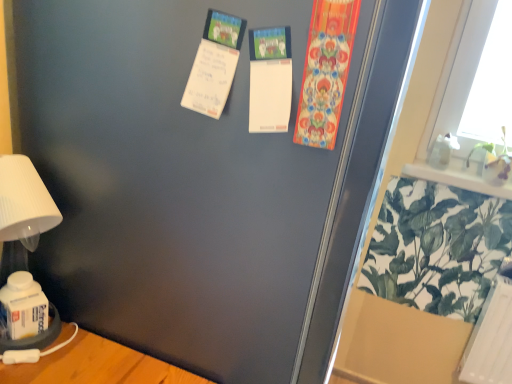
Question: Looking at the image, does green leafy plant at lower right, the first plant when ordered from bottom to top, seem bigger or smaller compared to white matte table lamp at lower left?

Choices:
 (A) small
 (B) big

Answer: (A)

Question: From the image's perspective, is green leafy plant at lower right, the second plant when ordered from top to bottom, positioned above or below white matte table lamp at lower left?

Choices:
 (A) below
 (B) above

Answer: (A)

Question: Based on their relative distances, which object is farther from the transparent plastic screen door at upper right?

Choices:
 (A) white paper postcard at upper center, which is the first postcard from left to right
 (B) green leafy plant at upper right, which appears as the 2th plant when ordered from the bottom
 (C) colorful fabric banner at upper right, which is counted as the second postcard, starting from the left
 (D) green leafy plant at lower right, the second plant when ordered from top to bottom
 (E) white matte table lamp at lower left

Answer: (B)

Question: Which object is positioned farthest from the green leafy plant at lower right, the second plant when ordered from top to bottom?

Choices:
 (A) colorful fabric banner at upper right, which is counted as the second postcard, starting from the left
 (B) green leafy plant at upper right, which appears as the 2th plant when ordered from the bottom
 (C) transparent plastic screen door at upper right
 (D) white paper postcard at upper center, placed as the second postcard when sorted from right to left
 (E) white matte table lamp at lower left

Answer: (E)